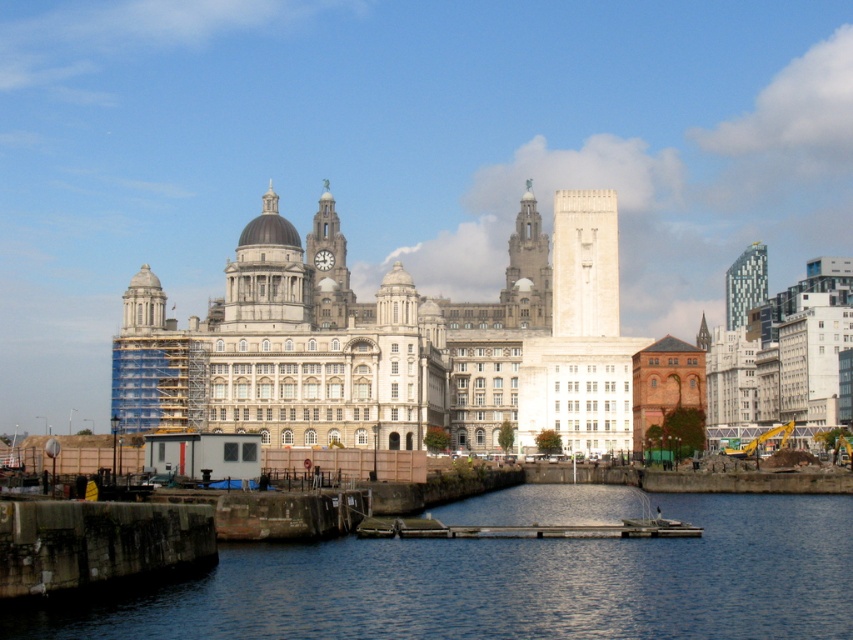
You are a photographer planning to capture a shot of the Liverpool waterfront. You want to include both the white stone building at center and the glassy steel tower at upper right. Based on their positions, which building will appear larger in your photo?

The white stone building at center will appear larger in the photo because it is closer to the viewer than the glassy steel tower at upper right, making it occupy more space in the frame.

You are a tourist standing on the Liverpool waterfront and want to take a photo that includes both the white stone building at center and the glassy steel tower at upper right. Which building should you position closer to the center of your camera frame to ensure both are fully visible?

You should position the white stone building at center closer to the center of your camera frame because it is taller than the glassy steel tower at upper right, ensuring both fit within the frame.

You are a tourist standing on the waterfront and want to take a photo of the white stone building at center and the white stone clock tower at center. Which one will appear closer to you in the photo?

The white stone building at center will appear closer to you in the photo because it is in front of the white stone clock tower at center.